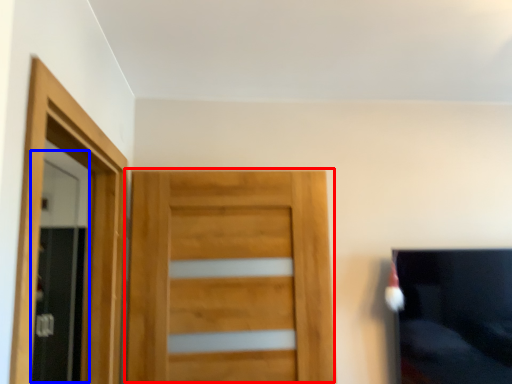
Question: Among these objects, which one is farthest to the camera, door (highlighted by a red box) or screen door (highlighted by a blue box)?

Choices:
 (A) door
 (B) screen door

Answer: (B)